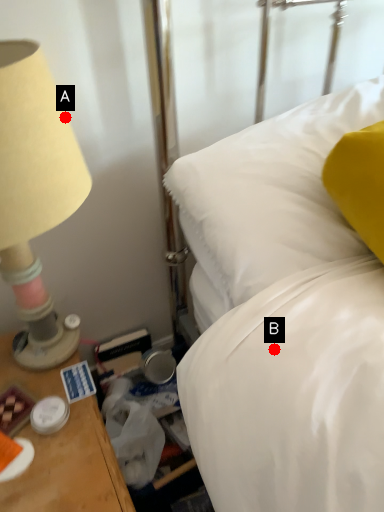
Question: Two points are circled on the image, labeled by A and B beside each circle. Which point is farther from the camera taking this photo?

Choices:
 (A) A is further
 (B) B is further

Answer: (A)